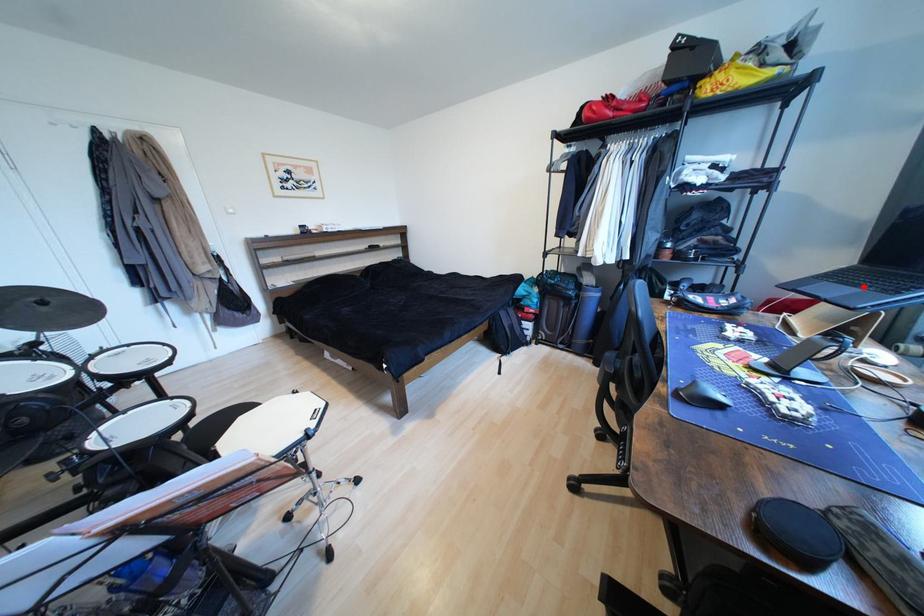
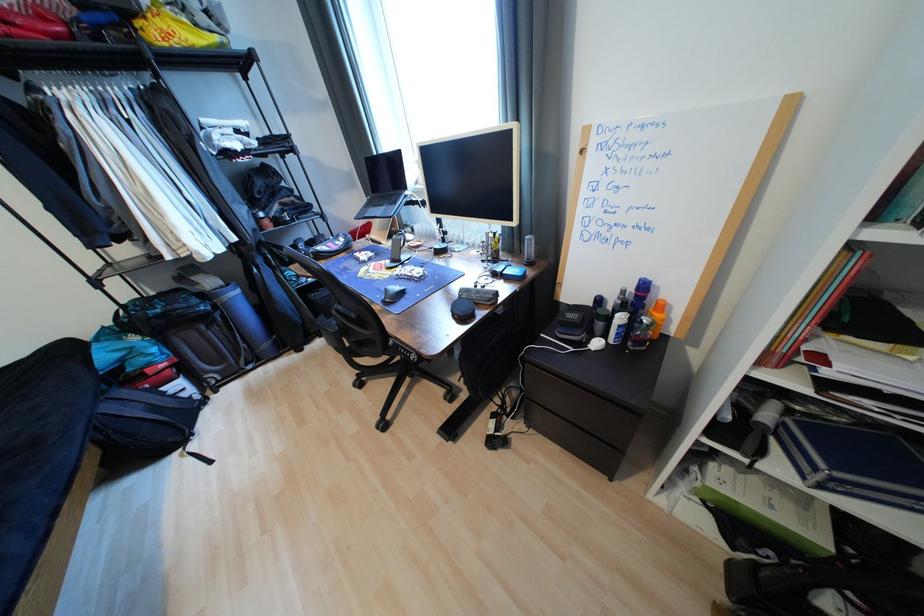
Question: I am providing you with two images of the same scene from different viewpoints. Image1 has a red point marked. In image2, the corresponding 3D location appears at what relative position? Reply with the corresponding letter.

Choices:
 (A) Closer
 (B) Farther

Answer: (A)